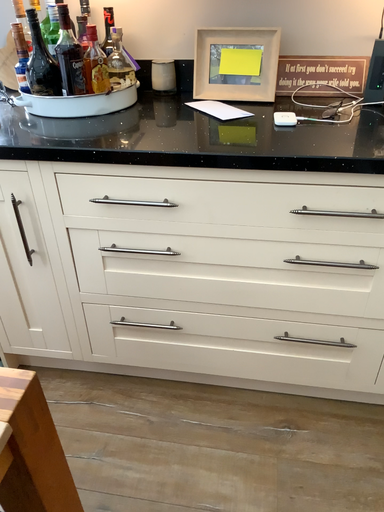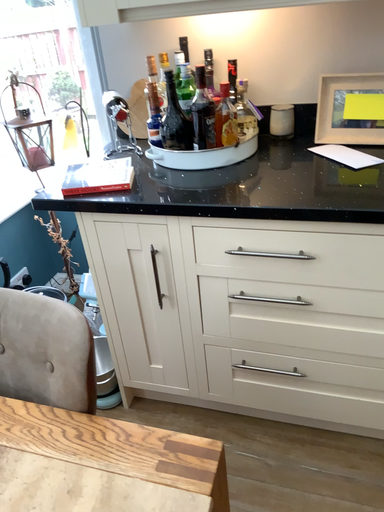
Question: How did the camera likely rotate when shooting the video?

Choices:
 (A) rotated right
 (B) rotated left

Answer: (B)